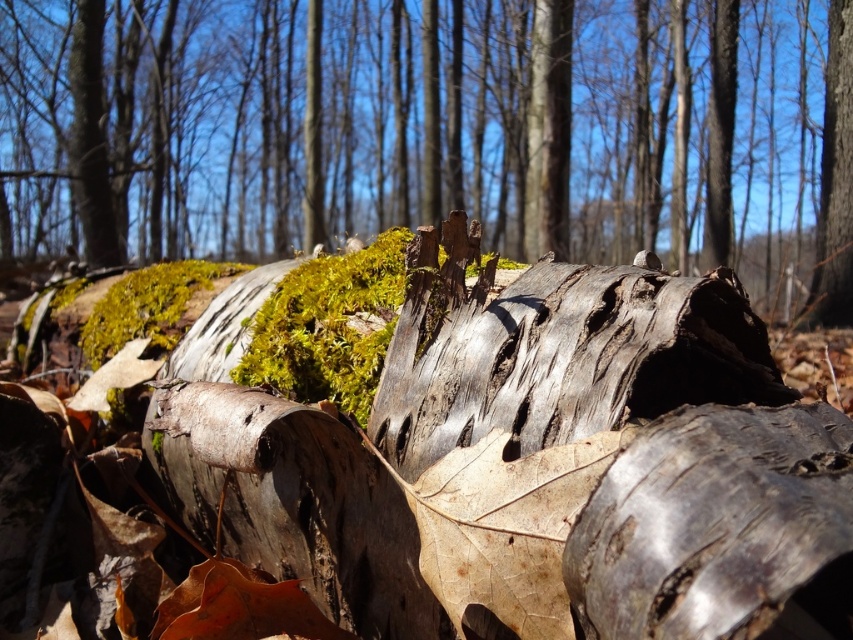
You are a hiker who just found two tree trunks in the forest. One is the smooth bark tree trunk at upper right and the other is the smooth brown bark at center. Which one is positioned more to the right side of the scene?

The smooth bark tree trunk at upper right is positioned more to the right side of the scene compared to the smooth brown bark at center.

You are a hiker who has just found a rough bark log at center and a smooth brown bark at center in the forest. You need to place a 5 meter long hiking pole between them. Can you fit the pole between the two objects without bending it?

The rough bark log at center and smooth brown bark at center are 5.05 meters apart from each other. Since the pole is 5 meters long, it can be placed between them as the distance is slightly longer than the pole.